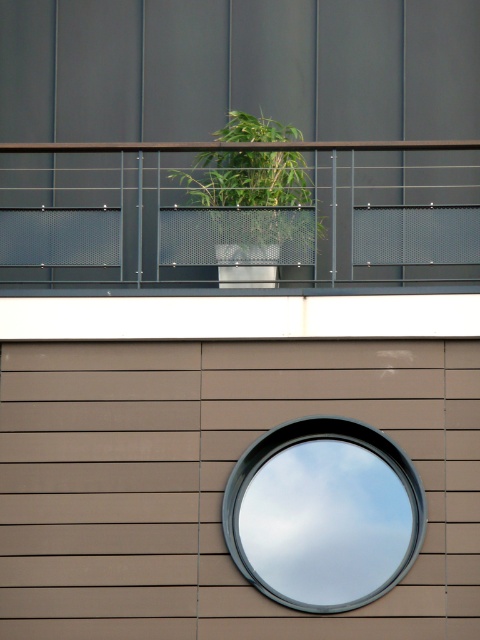
You are a window cleaner standing at the base of the building. You need to clean both the white plastic pot at upper center and the smooth glass mirror at center. Which object should you clean first based on their positions?

The white plastic pot at upper center is in front of the smooth glass mirror at center, so you should clean the white plastic pot at upper center first to avoid getting the mirror dirty again after cleaning it.

You are standing in front of the building facade and want to see your reflection. Which object can you use to see your reflection, the smooth glass mirror at center or the green leafy plant at center?

The smooth glass mirror at center is in front of the green leafy plant at center, so you can use the smooth glass mirror at center to see your reflection because mirrors reflect images clearly while plants do not.